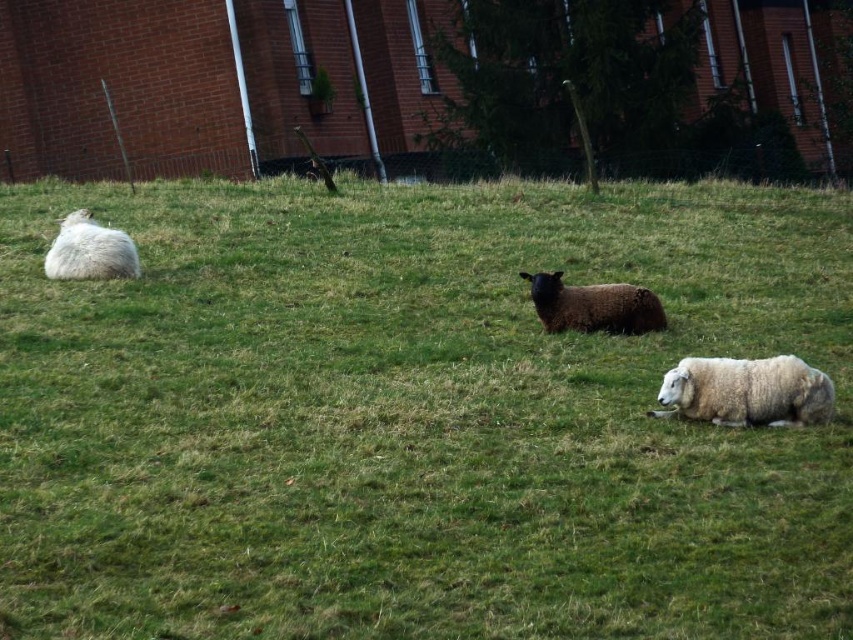
Question: Which point is closer to the camera?

Choices:
 (A) white woolly sheep at upper left
 (B) dark brown woolly sheep at center

Answer: (A)

Question: Is white woolly sheep at upper left to the left of dark brown woolly sheep at center from the viewer's perspective?

Choices:
 (A) no
 (B) yes

Answer: (B)

Question: Which point is farther to the camera?

Choices:
 (A) (659, 307)
 (B) (683, 253)

Answer: (B)

Question: Does dark brown woolly sheep at center appear on the right side of white fluffy sheep at left?

Choices:
 (A) no
 (B) yes

Answer: (B)

Question: Can you confirm if white woolly sheep at upper left is positioned to the right of dark brown woolly sheep at center?

Choices:
 (A) no
 (B) yes

Answer: (A)

Question: Which point is closer to the camera?

Choices:
 (A) dark brown woolly sheep at center
 (B) white woolly sheep at lower right
 (C) white woolly sheep at upper left
 (D) white fluffy sheep at left

Answer: (C)